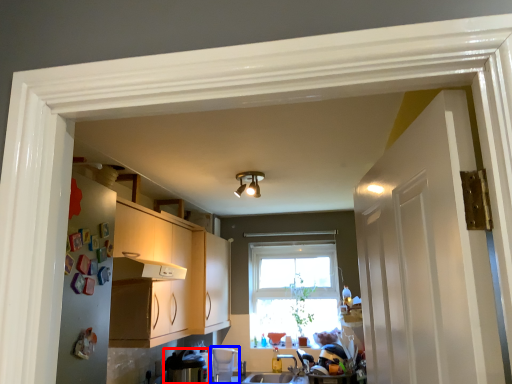
Question: Which of the following is the farthest to the observer, appliance (highlighted by a red box) or appliance (highlighted by a blue box)?

Choices:
 (A) appliance
 (B) appliance

Answer: (B)